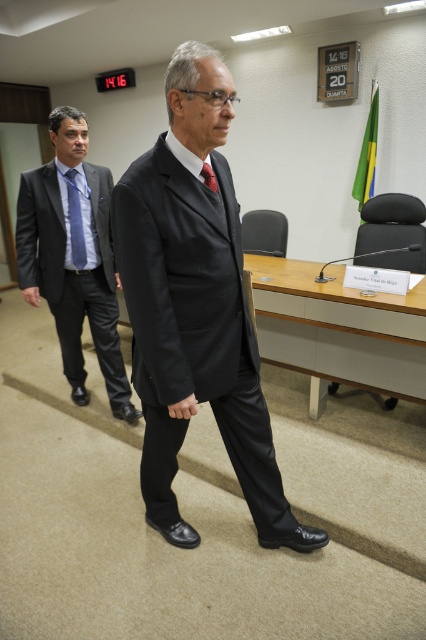
Question: From the image, what is the correct spatial relationship of matte black suit at center in relation to blue striped tie at left?

Choices:
 (A) above
 (B) below

Answer: (B)

Question: Can you confirm if matte black suit at left is positioned to the right of red silk tie at center?

Choices:
 (A) no
 (B) yes

Answer: (A)

Question: Which of the following is the farthest from the observer?

Choices:
 (A) matte black suit at center
 (B) red silk tie at center
 (C) blue striped tie at left
 (D) matte black suit at left

Answer: (C)

Question: Which point is farther from the camera taking this photo?

Choices:
 (A) (216, 184)
 (B) (74, 230)

Answer: (B)

Question: Where is matte black suit at center located in relation to matte black suit at left in the image?

Choices:
 (A) left
 (B) right

Answer: (B)

Question: Which point is farther from the camera taking this photo?

Choices:
 (A) (157, 406)
 (B) (213, 177)
 (C) (32, 221)

Answer: (C)